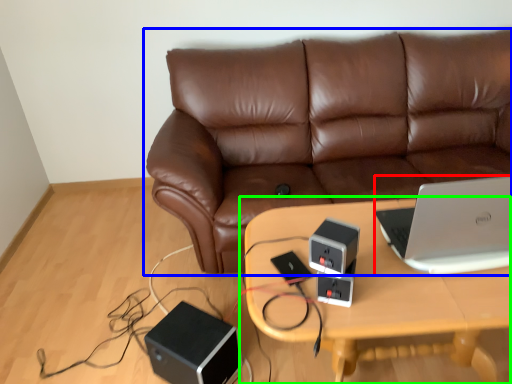
Question: Estimate the real-world distances between objects in this image. Which object is closer to laptop (highlighted by a red box), studio couch (highlighted by a blue box) or table (highlighted by a green box)?

Choices:
 (A) studio couch
 (B) table

Answer: (B)